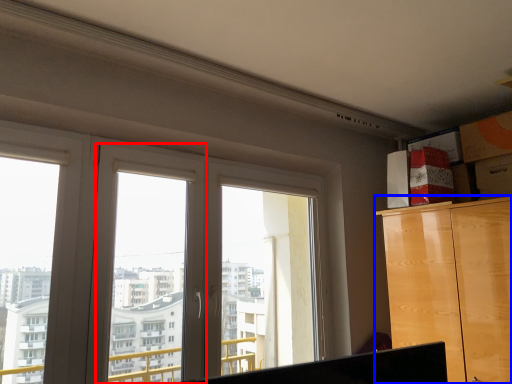
Question: Which point is closer to the camera, window frame (highlighted by a red box) or cabinetry (highlighted by a blue box)?

Choices:
 (A) window frame
 (B) cabinetry

Answer: (A)